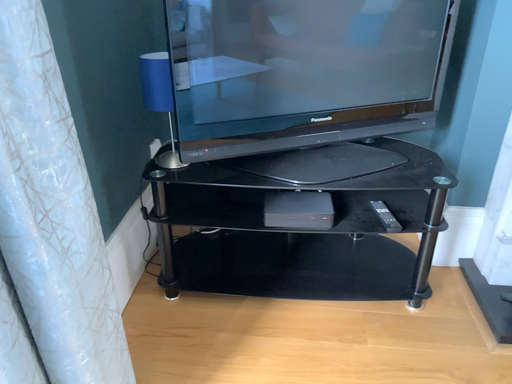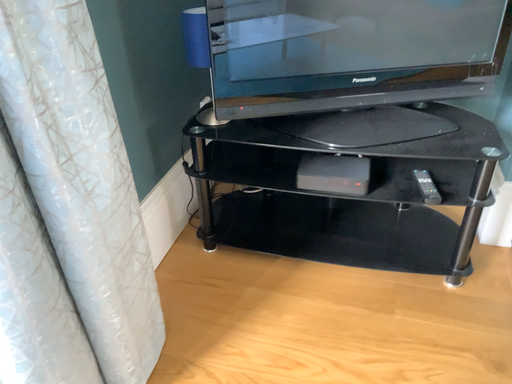
Question: Which way did the camera rotate in the video?

Choices:
 (A) rotated left
 (B) rotated right

Answer: (A)